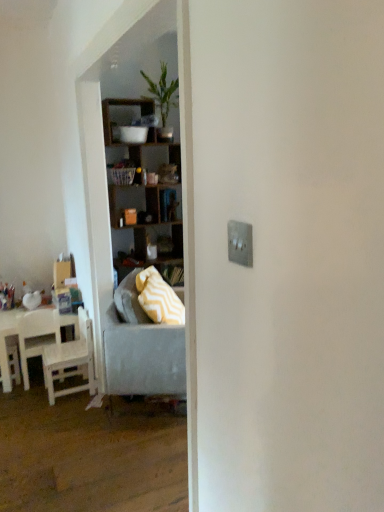
Identify the location of free point in front of white wood chair at left, marked as the first chair in a right-to-left arrangement. The height and width of the screenshot is (512, 384). (51, 411).